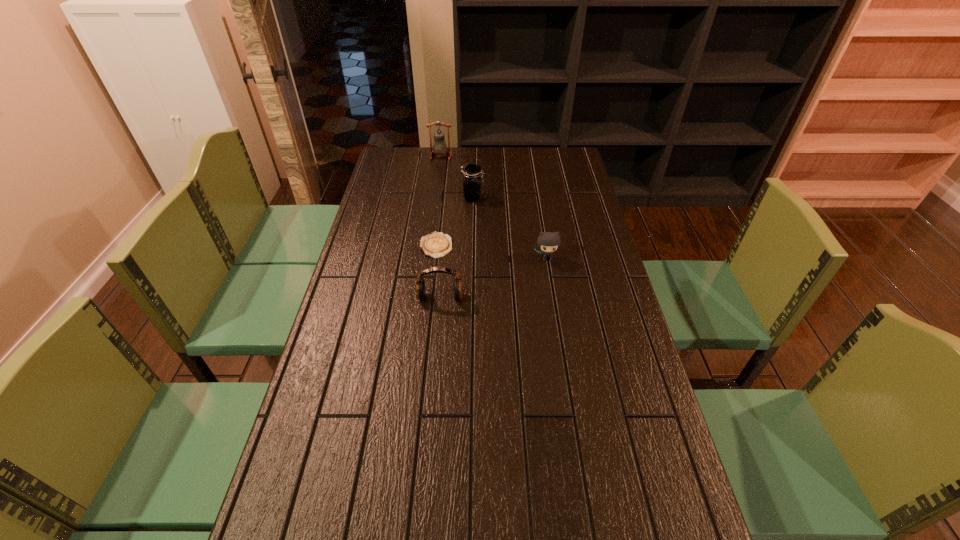
You are a GUI agent. You are given a task and a screenshot of the screen. Output one action in this format:
    pyautogui.click(x=<x>, y=<y>)
    Task: Click on the free space located on the front of the shortest object
    The image size is (960, 540).
    Given the screenshot: What is the action you would take?
    pyautogui.click(x=424, y=356)

The height and width of the screenshot is (540, 960). I want to click on object present at the far edge, so click(x=439, y=140).

Where is `object that is at the right edge`? This screenshot has width=960, height=540. object that is at the right edge is located at coordinates (548, 242).

Locate an element on the screen. The width and height of the screenshot is (960, 540). vacant position at the far edge of the desktop is located at coordinates (525, 157).

In the image, there is a desktop. At what (x,y) coordinates should I click in order to perform the action: click on free region at the left edge. Please return your answer as a coordinate pair (x, y). The image size is (960, 540). Looking at the image, I should click on (361, 368).

Where is `vacant space at the right edge`? Image resolution: width=960 pixels, height=540 pixels. vacant space at the right edge is located at coordinates (568, 196).

Where is `free space at the far right corner of the desktop`? Image resolution: width=960 pixels, height=540 pixels. free space at the far right corner of the desktop is located at coordinates (562, 154).

Find the location of a particular element. This screenshot has height=540, width=960. vacant area that lies between the kitten and the quiche is located at coordinates (492, 252).

This screenshot has height=540, width=960. I want to click on vacant point located between the kitten and the quiche, so click(492, 252).

The image size is (960, 540). I want to click on empty space between the shortest object and the farthest object, so click(439, 201).